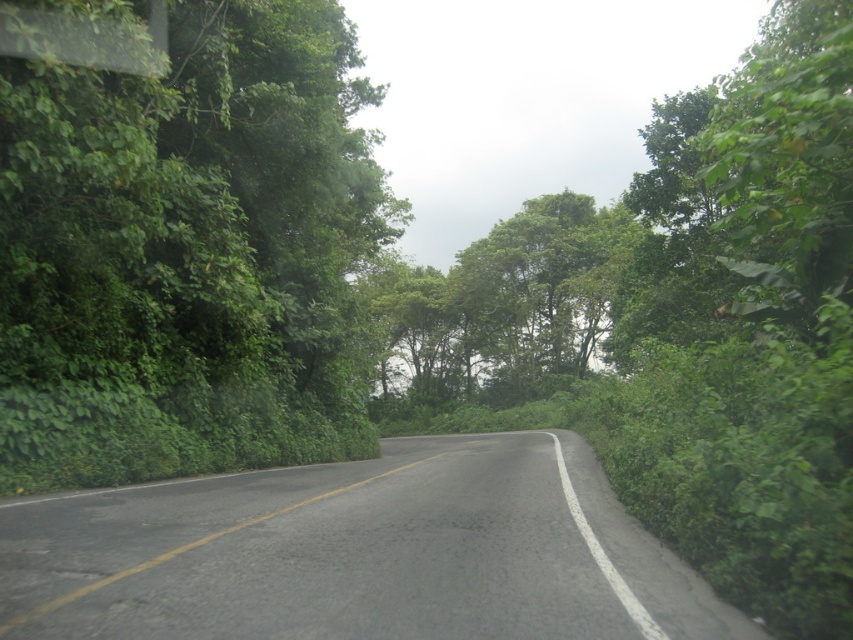
Question: Is green leafy tree at left below black asphalt road at center?

Choices:
 (A) no
 (B) yes

Answer: (A)

Question: Which is farther from the black asphalt road at center?

Choices:
 (A) green leafy tree at left
 (B) green leafy tree at center

Answer: (B)

Question: Which point is farther from the camera taking this photo?

Choices:
 (A) (544, 323)
 (B) (527, 449)
 (C) (343, 161)

Answer: (A)

Question: Estimate the real-world distances between objects in this image. Which object is farther from the green leafy tree at center?

Choices:
 (A) green leafy tree at left
 (B) black asphalt road at center

Answer: (B)

Question: Is black asphalt road at center closer to the viewer compared to green leafy tree at center?

Choices:
 (A) yes
 (B) no

Answer: (A)

Question: Can you confirm if black asphalt road at center is positioned to the right of green leafy tree at center?

Choices:
 (A) no
 (B) yes

Answer: (A)